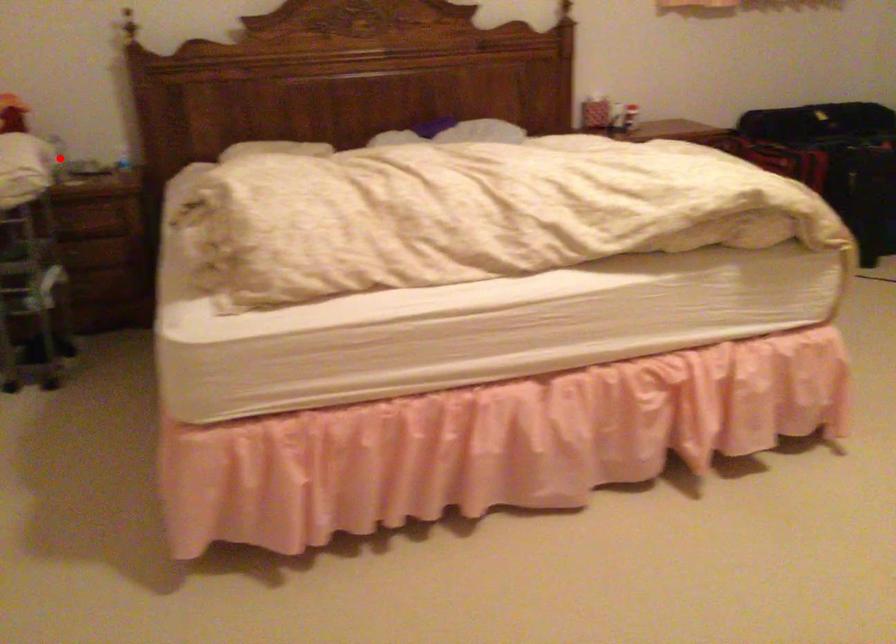
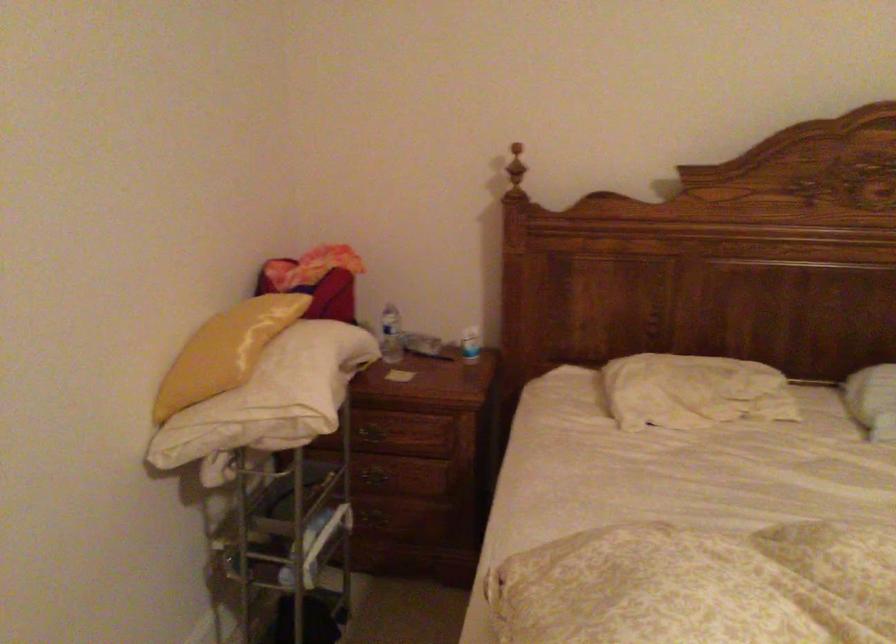
Question: I am providing you with two images of the same scene from different viewpoints. A red point is marked on the first image. Can you still see the location of the red point in image 2?

Choices:
 (A) Yes
 (B) No

Answer: (B)